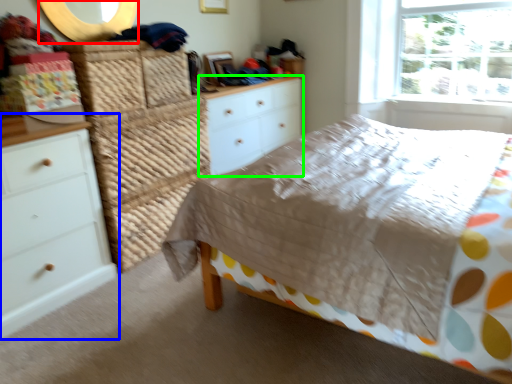
Question: Estimate the real-world distances between objects in this image. Which object is closer to mirror (highlighted by a red box), chest of drawers (highlighted by a blue box) or chest of drawers (highlighted by a green box)?

Choices:
 (A) chest of drawers
 (B) chest of drawers

Answer: (A)